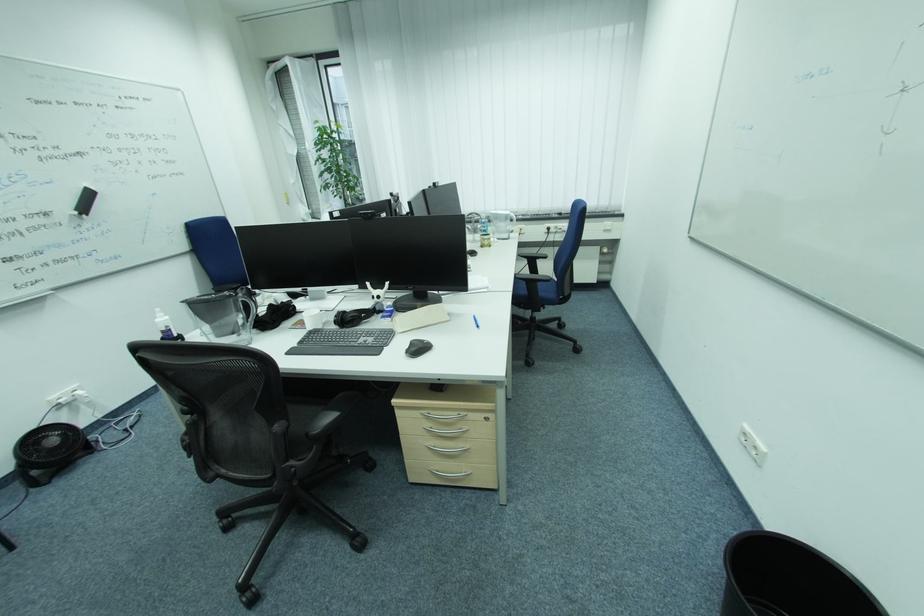
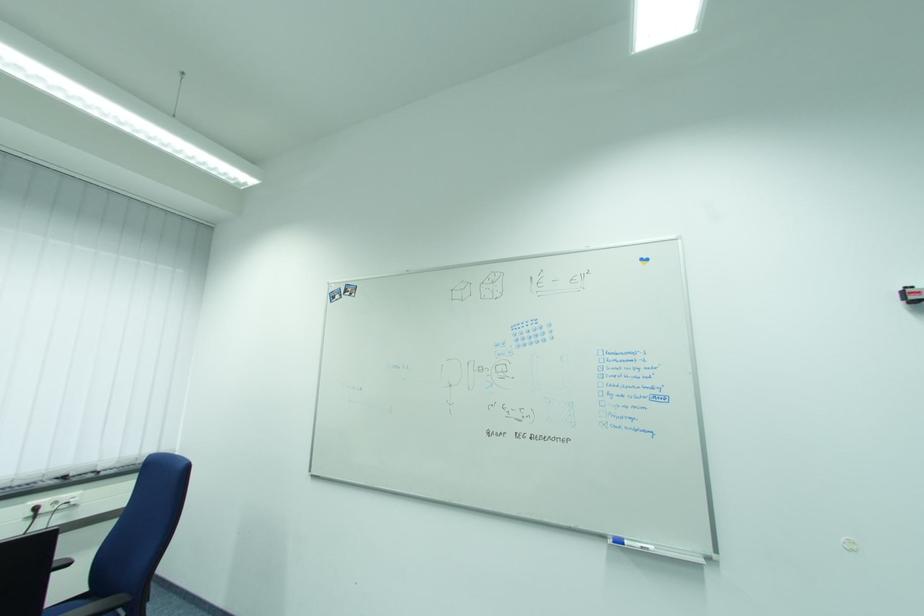
The images are taken continuously from a first-person perspective. In which direction is your viewpoint rotating?

The rotation direction of the camera is right-up.